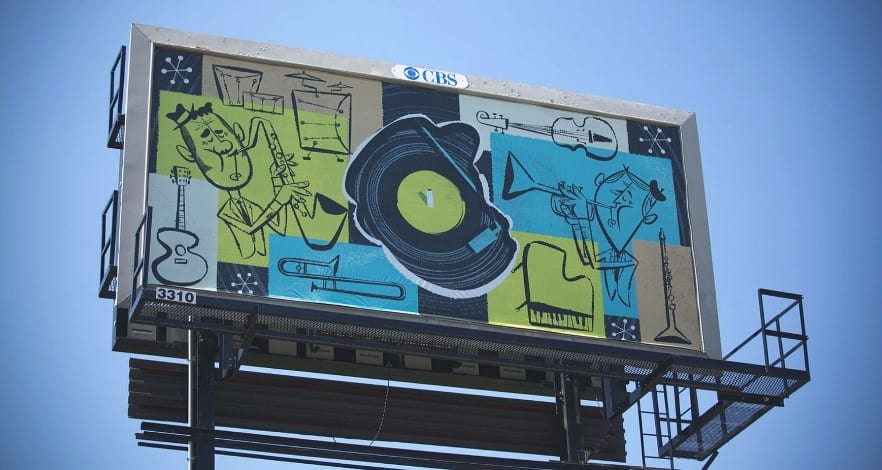
Image resolution: width=882 pixels, height=470 pixels. What are the coordinates of `piano` in the screenshot? It's located at (542, 273).